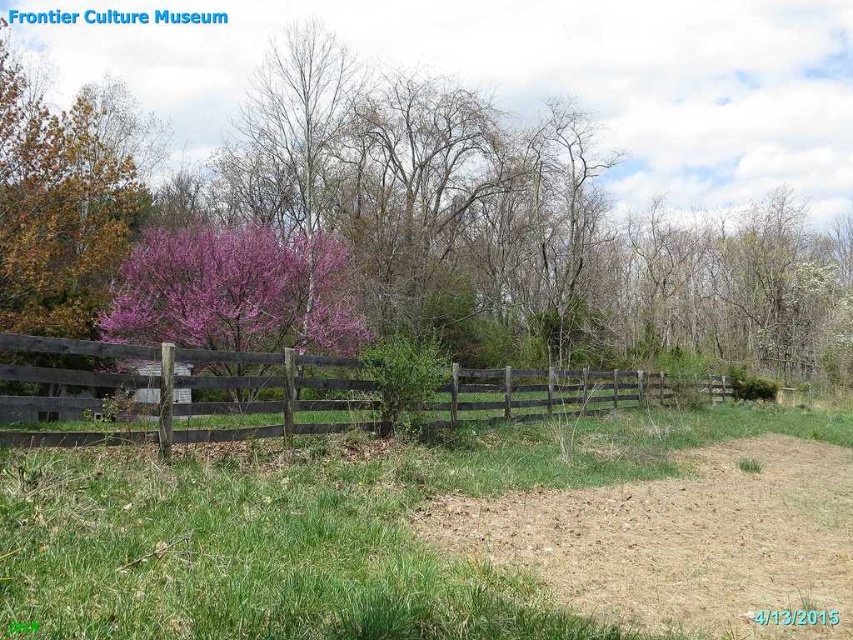
You are a gardener who wants to plant a new flower bed near the purple bloom at center and the purple bloom tree at center. Which one should you plant closer to the ground level to match their heights?

The purple bloom at center is much taller than the purple bloom tree at center, so you should plant the new flower bed closer to the ground level near the purple bloom tree at center to match its shorter height.

You are a hiker who wants to walk from the grassy area to the dirt track. The purple bloom tree at center is blocking your path. Can you go around it using the brown dirt track at lower right?

The brown dirt track at lower right is in front of the purple bloom tree at center, so you can walk along the brown dirt track at lower right to bypass the purple bloom tree at center and reach your destination.